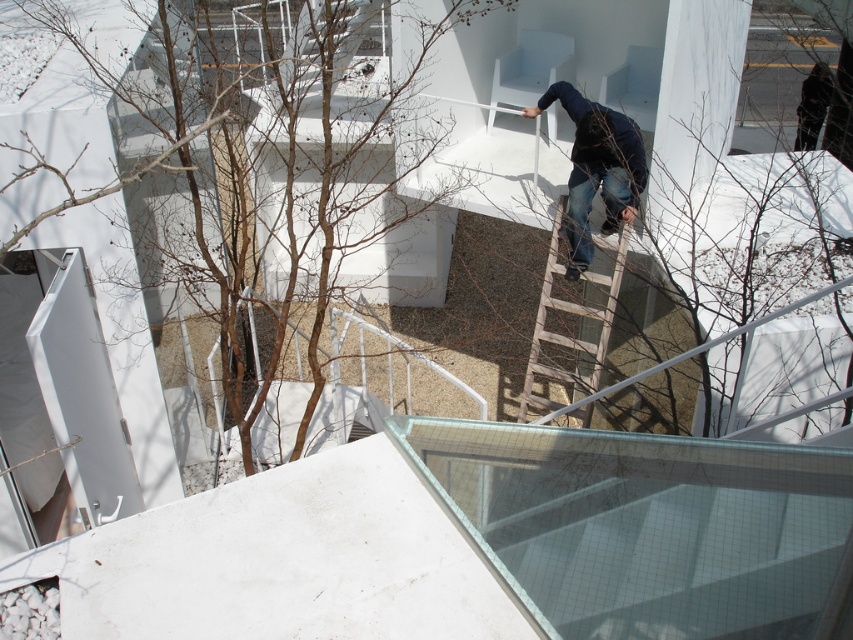
Can you confirm if wooden at center is smaller than blue jeans at center?

Yes, wooden at center is smaller than blue jeans at center.

Is point (604, 314) positioned in front of point (590, 132)?

No, (604, 314) is further to viewer.

What are the coordinates of `wooden at center` in the screenshot? It's located at (572, 324).

This screenshot has width=853, height=640. Find the location of `wooden at center`. wooden at center is located at coordinates (572, 324).